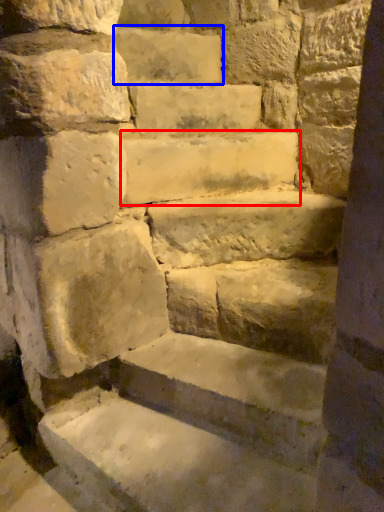
Question: Which point is further to the camera, stone (highlighted by a red box) or brick (highlighted by a blue box)?

Choices:
 (A) stone
 (B) brick

Answer: (B)